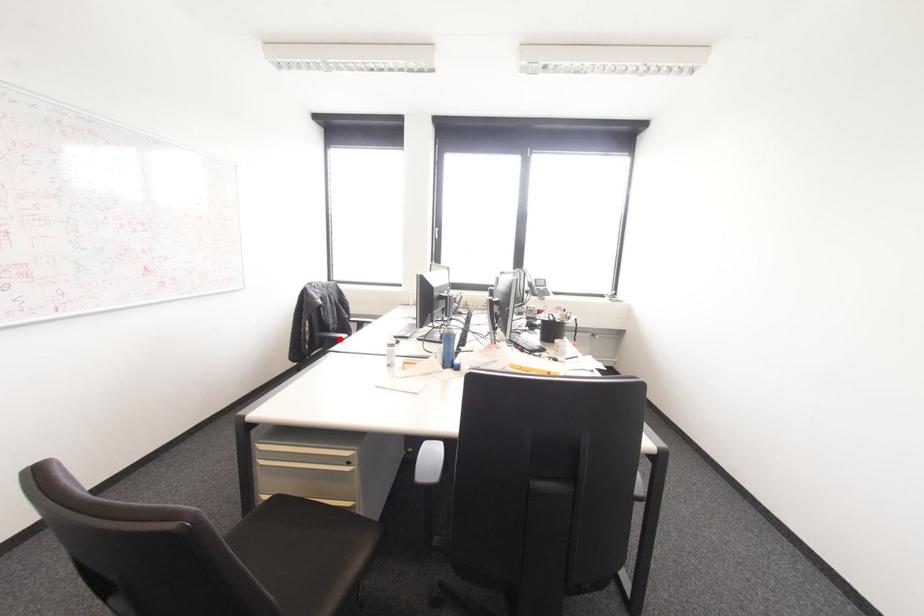
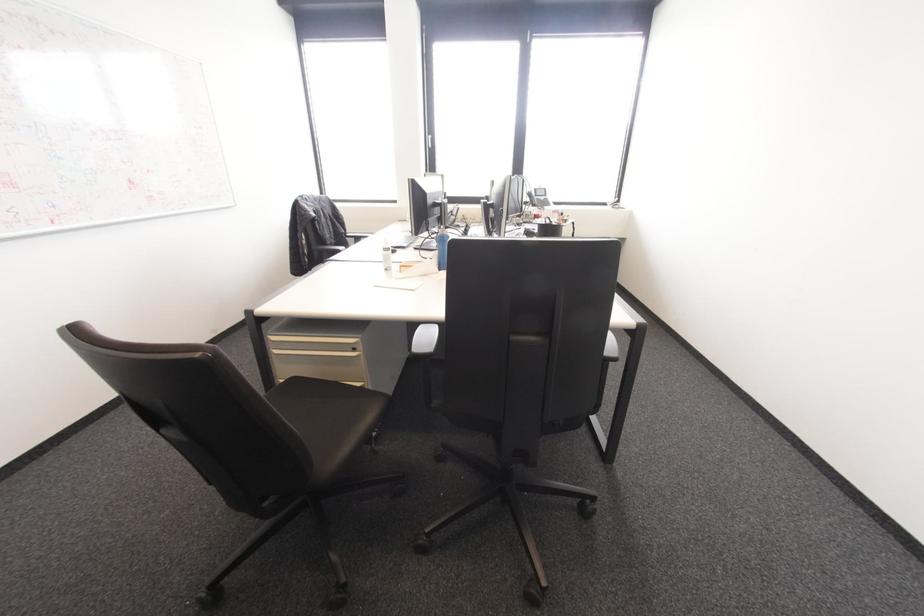
Question: I am providing you with two images of the same scene from different viewpoints. Given a red point in image1, look at the same physical point in image2. Is it:

Choices:
 (A) Closer to the viewpoint
 (B) Farther from the viewpoint

Answer: (B)